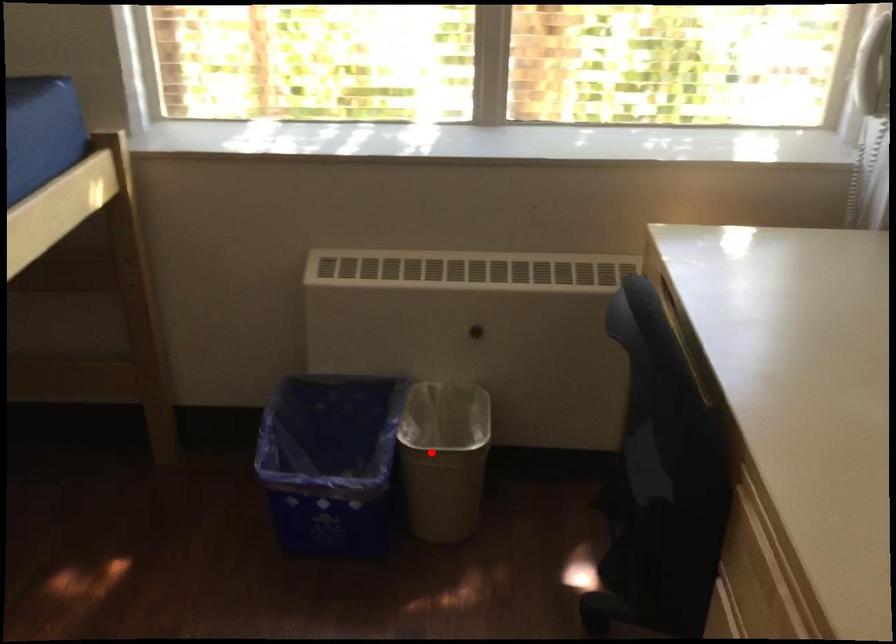
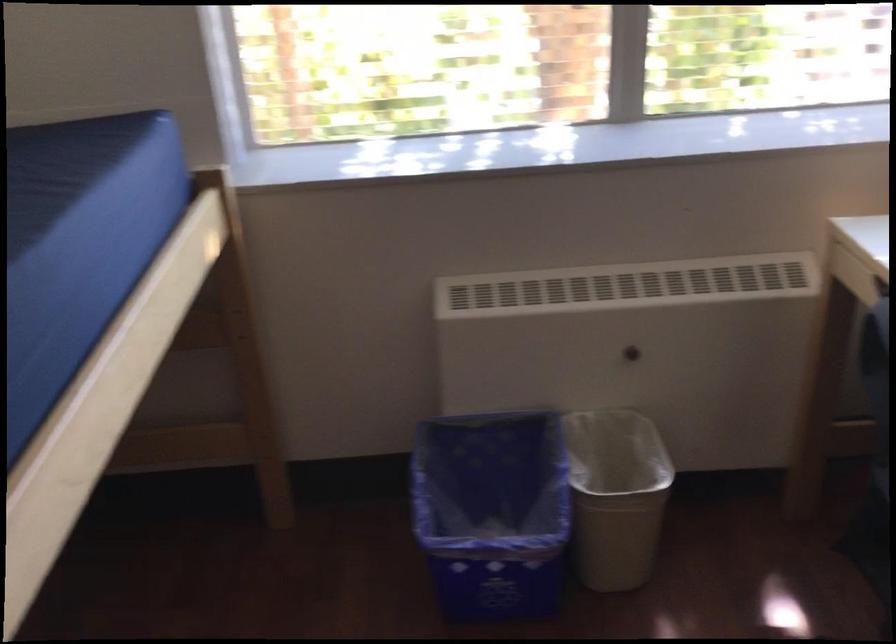
The point at the highlighted location is marked in the first image. Where is the corresponding point in the second image?

(616, 496)